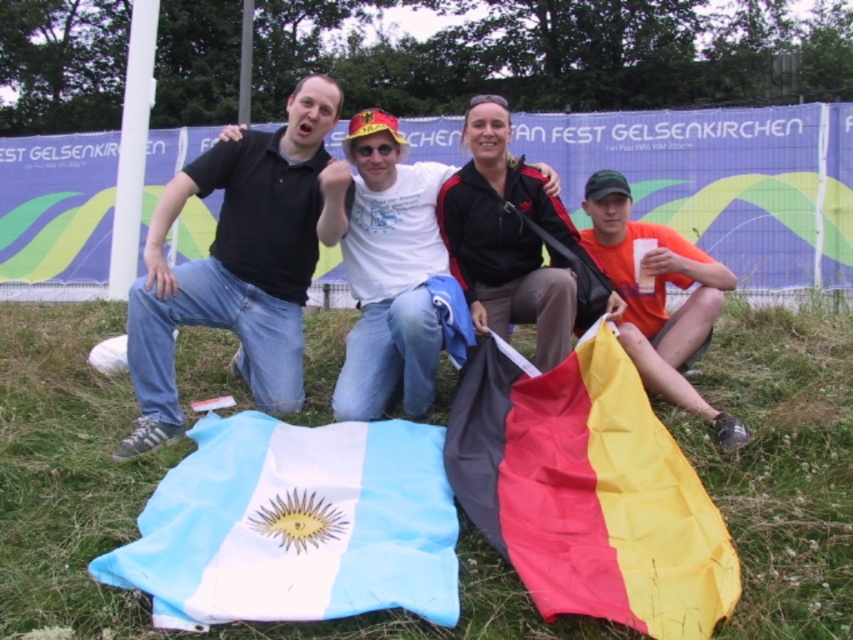
Question: Considering the relative positions of blue fabric flag at lower center and black matte jacket at center in the image provided, where is blue fabric flag at lower center located with respect to black matte jacket at center?

Choices:
 (A) below
 (B) above

Answer: (A)

Question: Estimate the real-world distances between objects in this image. Which object is farther from the orange matte t-shirt at lower right?

Choices:
 (A) black matte jacket at center
 (B) polyester flag at lower right
 (C) black matte shirt at center

Answer: (C)

Question: Does polyester flag at lower right lie in front of black matte jacket at center?

Choices:
 (A) yes
 (B) no

Answer: (A)

Question: Is white matte t-shirt at center to the left of orange matte t-shirt at lower right from the viewer's perspective?

Choices:
 (A) no
 (B) yes

Answer: (B)

Question: Which point is farther to the camera?

Choices:
 (A) (525, 192)
 (B) (683, 266)

Answer: (A)

Question: Which object is closer to the camera taking this photo?

Choices:
 (A) black matte shirt at center
 (B) blue fabric flag at lower center
 (C) green grass at lower center

Answer: (B)